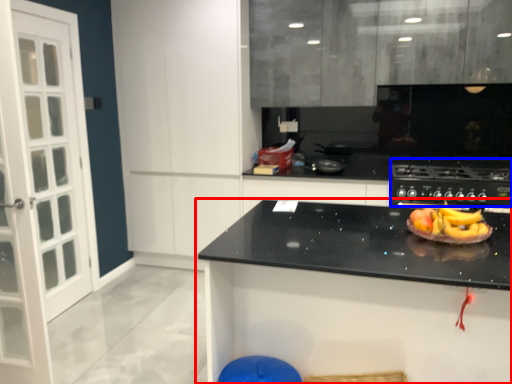
Question: Which object appears closest to the camera in this image, countertop (highlighted by a red box) or gas stove (highlighted by a blue box)?

Choices:
 (A) countertop
 (B) gas stove

Answer: (A)